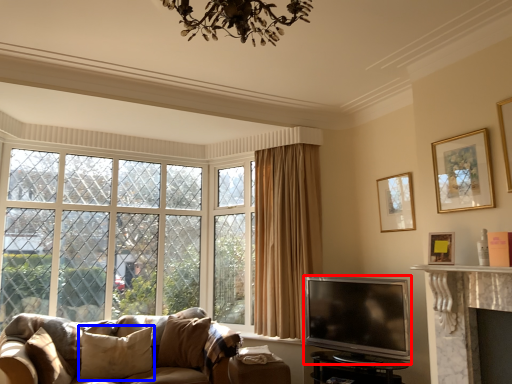
Question: Among these objects, which one is farthest to the camera, television (highlighted by a red box) or pillow (highlighted by a blue box)?

Choices:
 (A) television
 (B) pillow

Answer: (B)